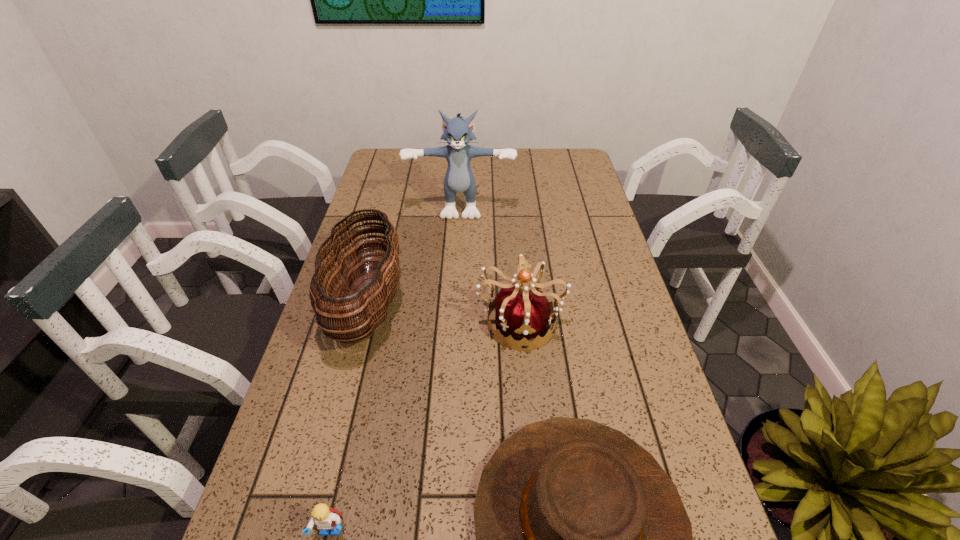
This screenshot has height=540, width=960. In order to click on the tallest object in this screenshot , I will do `click(459, 177)`.

This screenshot has height=540, width=960. Find the location of `cat`. cat is located at coordinates (x=459, y=177).

I want to click on tiara, so click(x=525, y=313).

The image size is (960, 540). I want to click on basket, so click(x=366, y=304).

The image size is (960, 540). In order to click on free space located 0.270m on the front-facing side of the cat in this screenshot , I will do `click(457, 276)`.

I want to click on vacant position located on the front-facing side of the tiara, so click(x=529, y=428).

Image resolution: width=960 pixels, height=540 pixels. In order to click on vacant space located 0.200m on the front of the basket in this screenshot , I will do [329, 453].

At what (x,y) coordinates should I click in order to perform the action: click on object that is at the left edge. Please return your answer as a coordinate pair (x, y). This screenshot has width=960, height=540. Looking at the image, I should click on (366, 304).

The width and height of the screenshot is (960, 540). I want to click on free region at the left edge, so click(x=305, y=410).

This screenshot has height=540, width=960. In the image, there is a desktop. What are the coordinates of `vacant space at the right edge` in the screenshot? It's located at (658, 417).